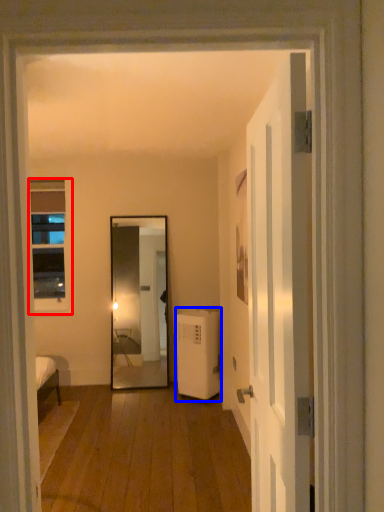
Question: Which of the following is the closest to the observer, window (highlighted by a red box) or air conditioner (highlighted by a blue box)?

Choices:
 (A) window
 (B) air conditioner

Answer: (B)